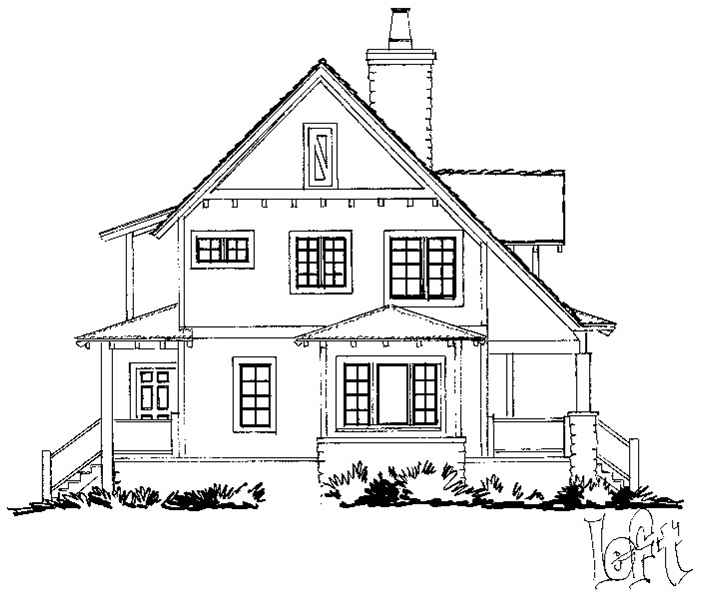
The height and width of the screenshot is (600, 725). Identify the location of hand rail. (612, 438).